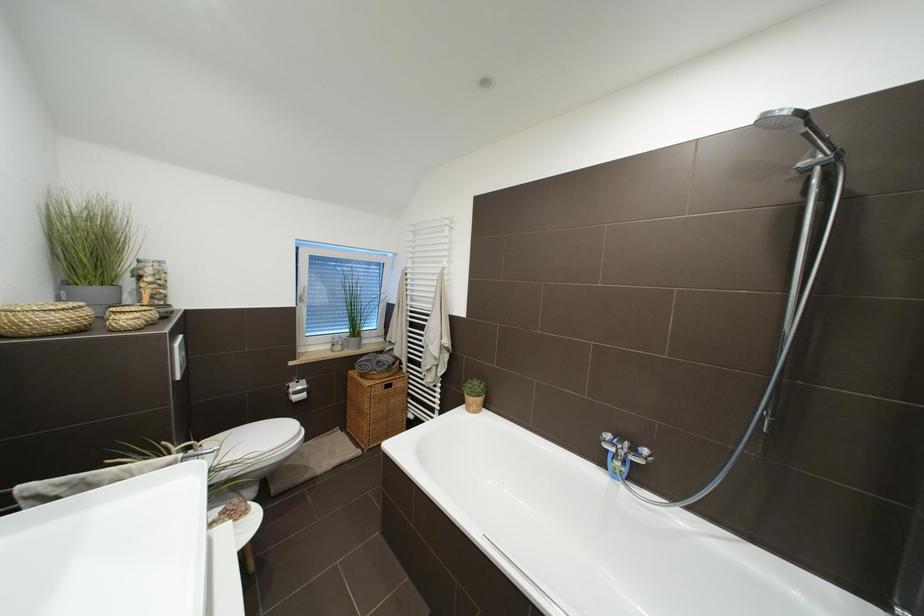
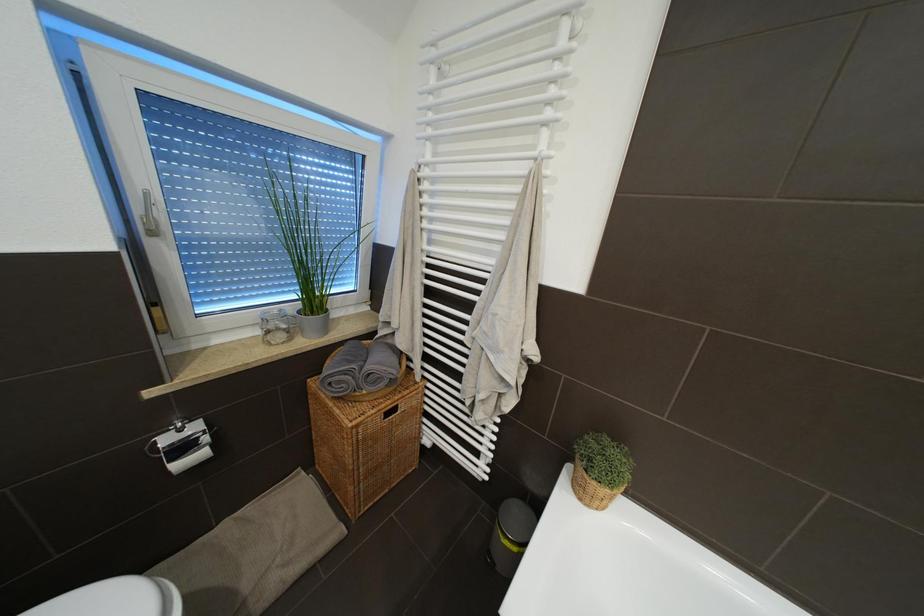
The images are taken continuously from a first-person perspective. In which direction are you moving?

The movement direction of the cameraman is left, forward.